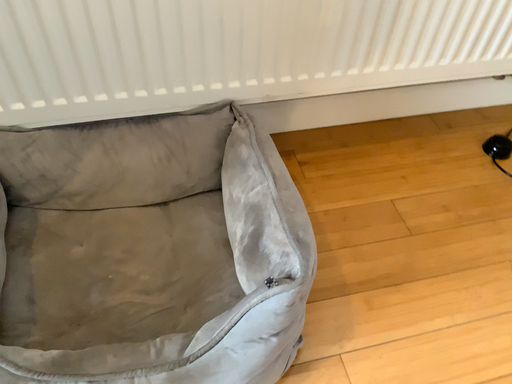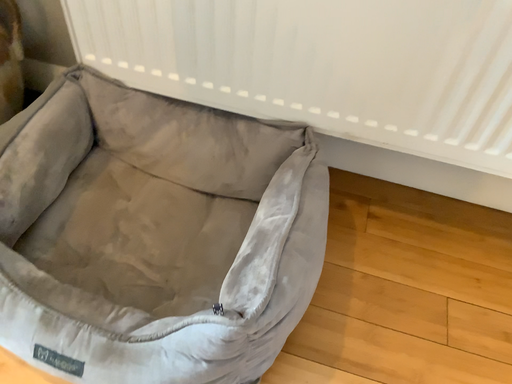
Question: Which way did the camera rotate in the video?

Choices:
 (A) rotated right
 (B) rotated left

Answer: (B)